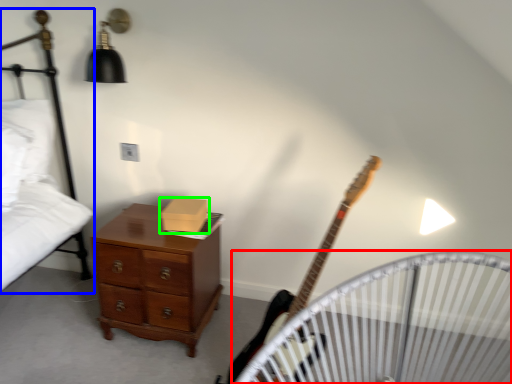
Question: Estimate the real-world distances between objects in this image. Which object is farther from infant bed (highlighted by a red box), bed (highlighted by a blue box) or box (highlighted by a green box)?

Choices:
 (A) bed
 (B) box

Answer: (A)